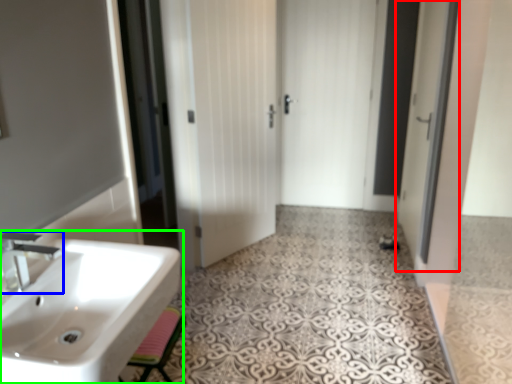
Question: Considering the real-world distances, which object is farthest from screen door (highlighted by a red box)? tap (highlighted by a blue box) or sink (highlighted by a green box)?

Choices:
 (A) tap
 (B) sink

Answer: (A)